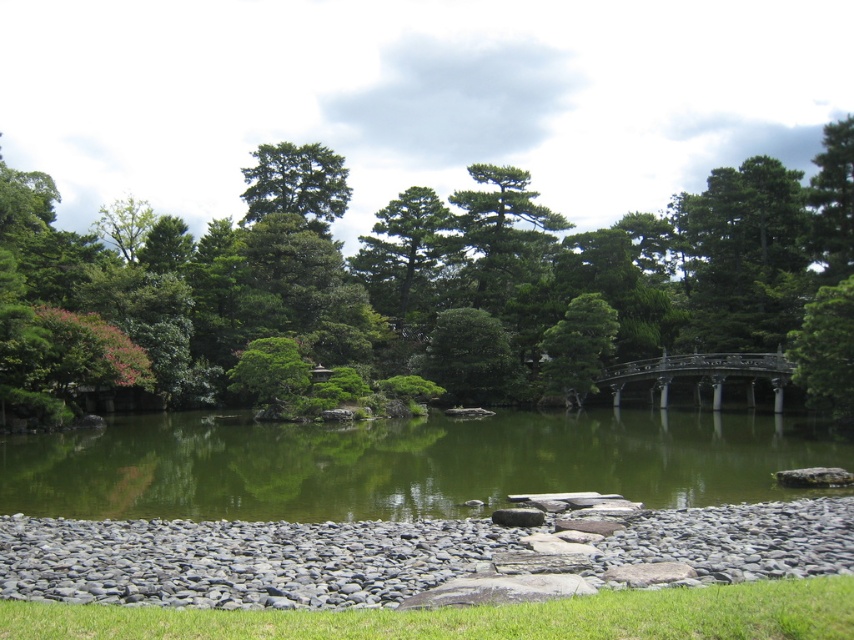
Does green smooth water at center have a lesser width compared to green textured tree at center?

In fact, green smooth water at center might be wider than green textured tree at center.

The image size is (854, 640). Identify the location of green smooth water at center. (402, 464).

Does point (296, 163) come in front of point (781, 380)?

No, it is behind (781, 380).

Is green matte tree at upper center below dark brown wooden bridge at center right?

No, green matte tree at upper center is not below dark brown wooden bridge at center right.

What do you see at coordinates (296, 182) in the screenshot?
I see `green matte tree at upper center` at bounding box center [296, 182].

I want to click on green matte tree at upper center, so click(296, 182).

Where is `green leafy tree at center`? green leafy tree at center is located at coordinates (412, 282).